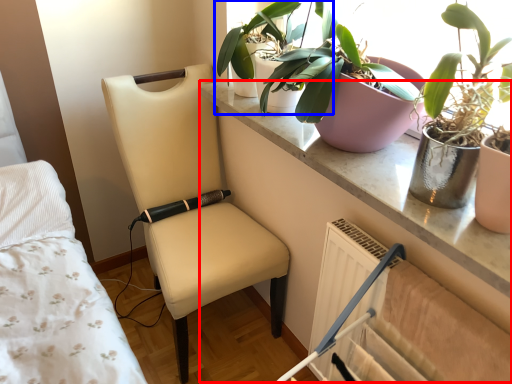
Question: Among these objects, which one is nearest to the camera, table (highlighted by a red box) or houseplant (highlighted by a blue box)?

Choices:
 (A) table
 (B) houseplant

Answer: (A)